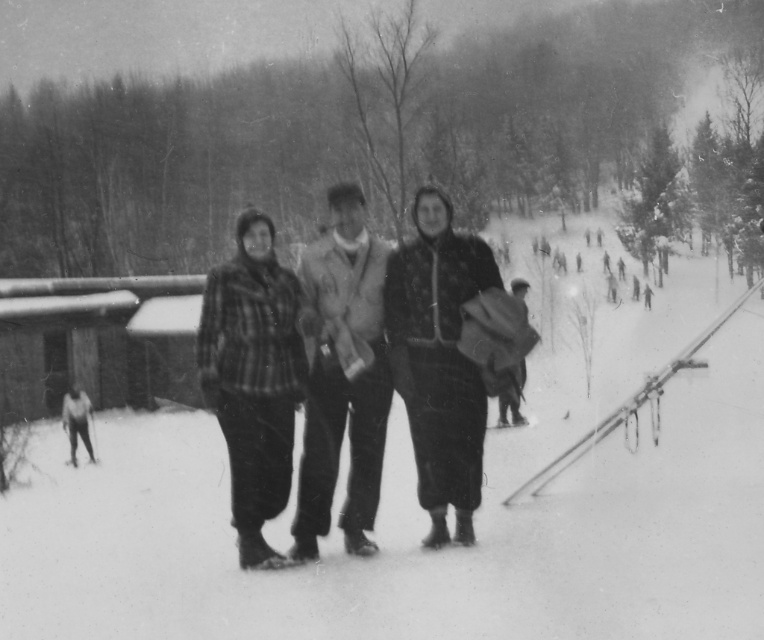
Question: Does white fluffy snow at center appear under plaid fabric jacket at center?

Choices:
 (A) no
 (B) yes

Answer: (A)

Question: Which point appears closest to the camera in this image?

Choices:
 (A) (211, 401)
 (B) (719, 333)
 (C) (442, 472)

Answer: (A)

Question: Which point is farther to the camera?

Choices:
 (A) (172, 477)
 (B) (319, 339)
 (C) (419, 236)
 (D) (256, 244)

Answer: (A)

Question: Which object appears closest to the camera in this image?

Choices:
 (A) white fluffy snow at center
 (B) plaid fabric pants at center

Answer: (A)

Question: Is white fluffy snow at center positioned before plaid fabric jacket at center?

Choices:
 (A) yes
 (B) no

Answer: (A)

Question: Can you confirm if plaid fabric pants at center is wider than knitted wool sweater at center?

Choices:
 (A) no
 (B) yes

Answer: (B)